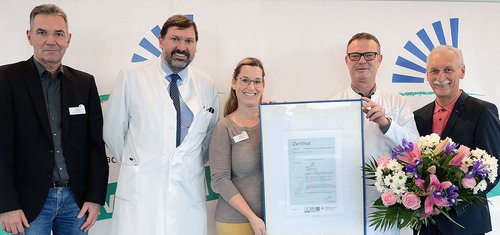
You are a GUI agent. You are given a task and a screenshot of the screen. Output one action in this format:
    pyautogui.click(x=<x>, y=<y>)
    Task: Click on the frame
    This screenshot has width=500, height=235.
    Given the screenshot: What is the action you would take?
    pyautogui.click(x=286, y=142), pyautogui.click(x=268, y=123)